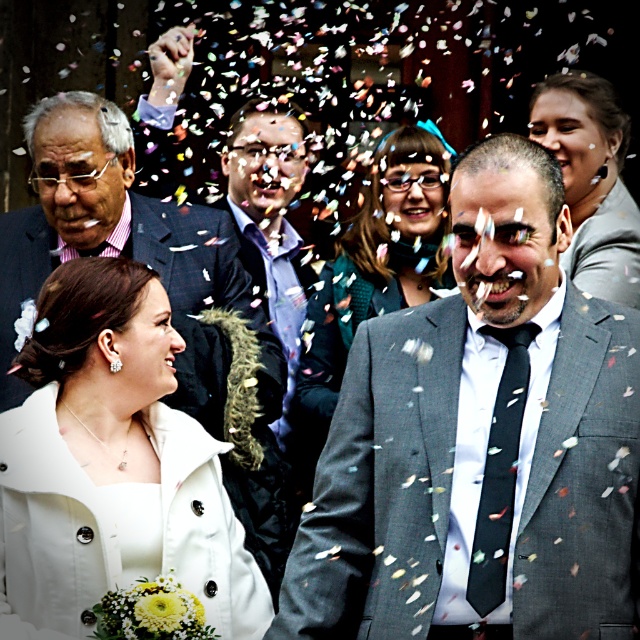
Question: Which object is the farthest from the plaid wool suit at left?

Choices:
 (A) white satin dress at lower left
 (B) matte gray suit at upper right

Answer: (B)

Question: From the image, what is the correct spatial relationship of plaid wool suit at left in relation to matte green dress at center?

Choices:
 (A) below
 (B) above

Answer: (A)

Question: Among these points, which one is nearest to the camera?

Choices:
 (A) (3, 467)
 (B) (584, 179)
 (C) (76, 170)
 (D) (449, 172)

Answer: (A)

Question: Observing the image, what is the correct spatial positioning of plaid wool suit at left in reference to matte gray suit at upper right?

Choices:
 (A) left
 (B) right

Answer: (A)

Question: Which of the following is the farthest from the observer?

Choices:
 (A) (326, 296)
 (B) (408, 445)
 (C) (102, 364)

Answer: (A)

Question: Can you confirm if plaid wool suit at left is wider than matte gray suit at upper right?

Choices:
 (A) yes
 (B) no

Answer: (A)